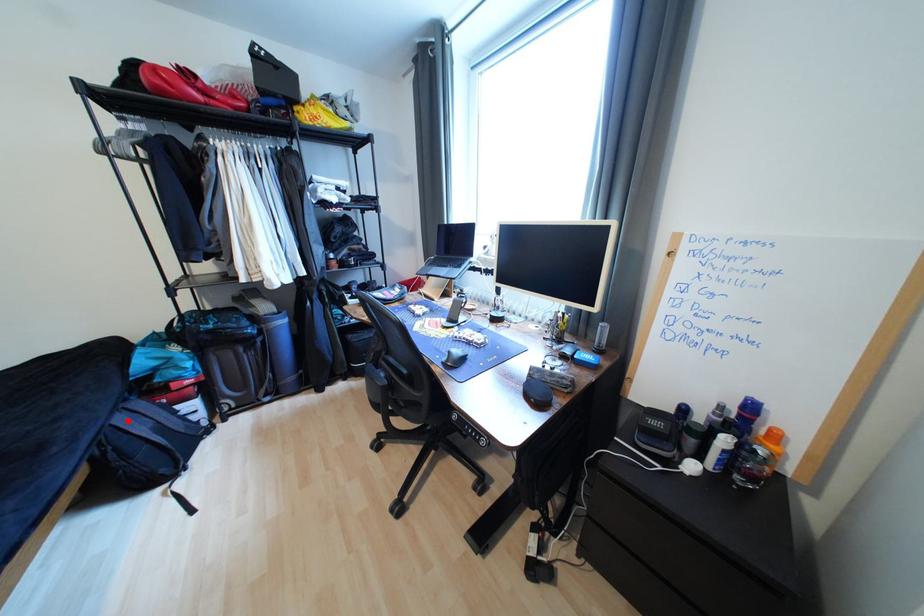
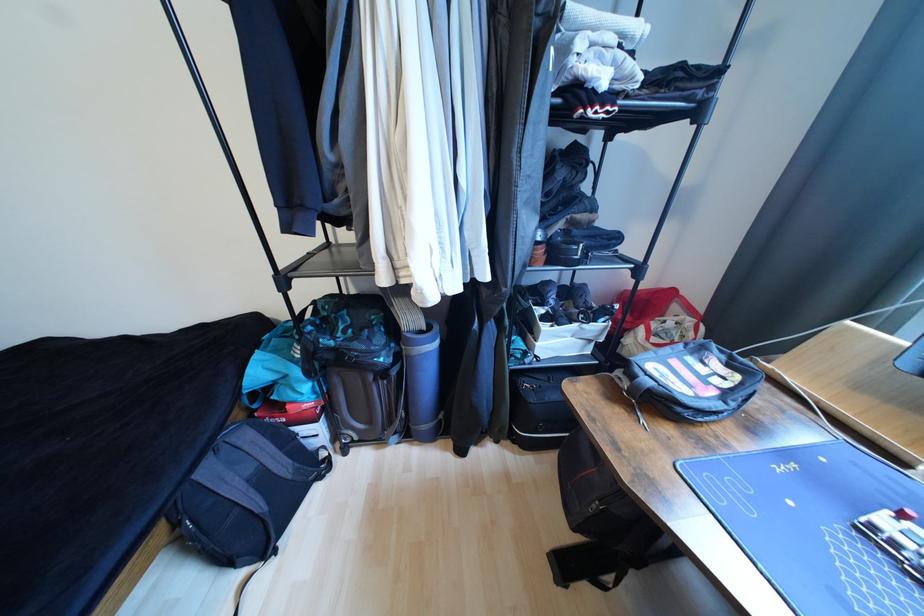
In the second image, find the point that corresponds to the highlighted location in the first image.

(215, 472)